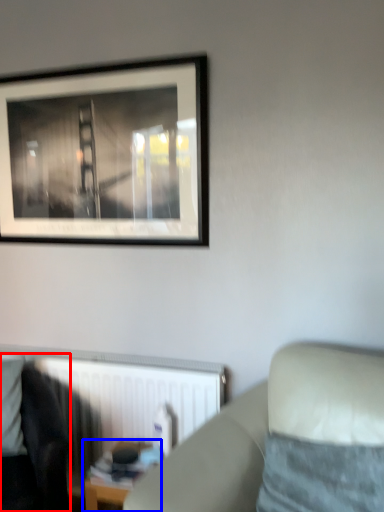
Question: Among these objects, which one is nearest to the camera, rocking chair (highlighted by a red box) or table (highlighted by a blue box)?

Choices:
 (A) rocking chair
 (B) table

Answer: (A)